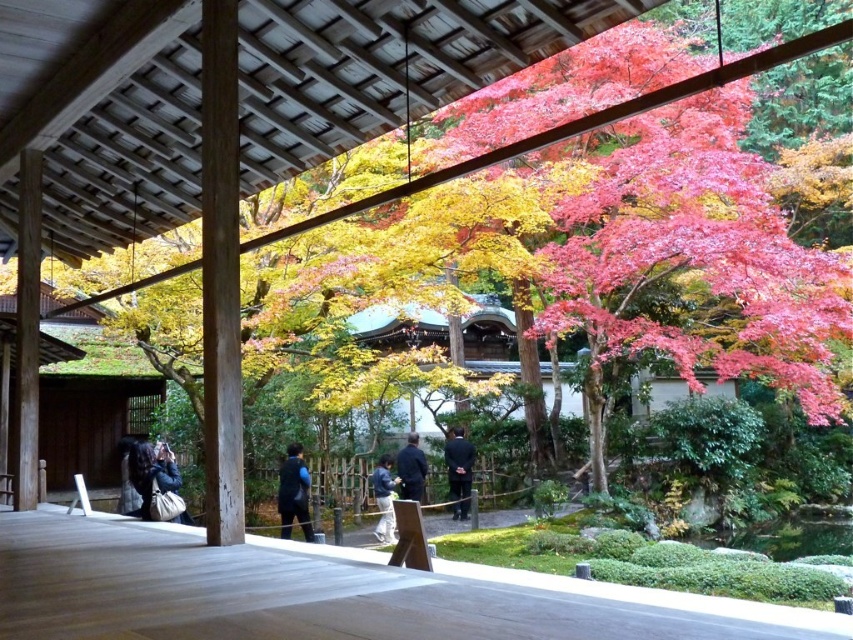
Question: Does black matte vest at center appear under dark blue jacket at center?

Choices:
 (A) yes
 (B) no

Answer: (B)

Question: Does dark blue fabric bag at lower left have a lesser width compared to dark blue jacket at center?

Choices:
 (A) no
 (B) yes

Answer: (A)

Question: Which point is closer to the camera taking this photo?

Choices:
 (A) (456, 502)
 (B) (144, 496)

Answer: (B)

Question: Which object is closer to the camera taking this photo?

Choices:
 (A) dark blue fabric bag at lower left
 (B) dark blue fabric jacket at center
 (C) dark blue jacket at center

Answer: (A)

Question: Does dark blue jacket at center appear on the left side of dark blue fabric jacket at center?

Choices:
 (A) no
 (B) yes

Answer: (B)

Question: Which point is farther from the camera taking this photo?

Choices:
 (A) (380, 458)
 (B) (131, 465)
 (C) (300, 516)
 (D) (421, 468)

Answer: (A)